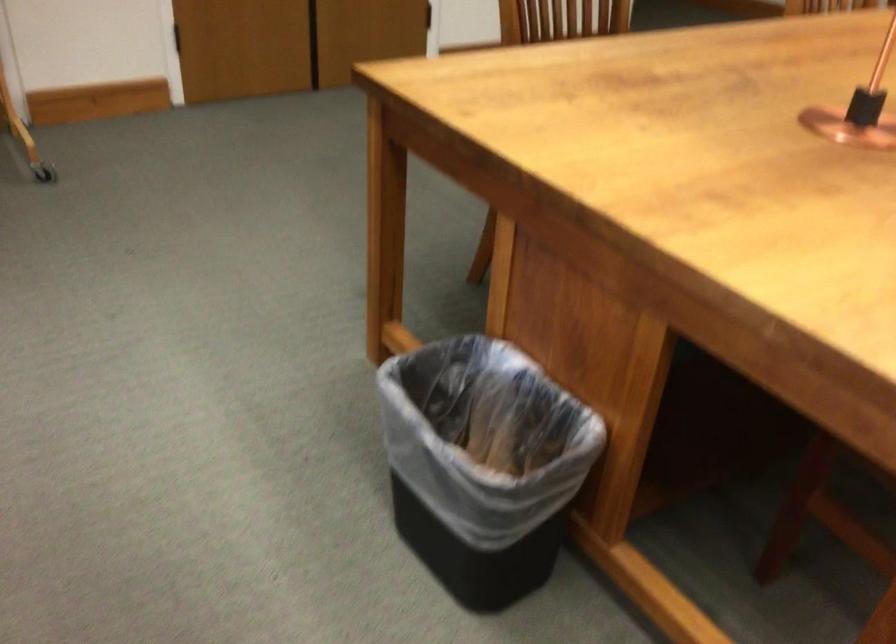
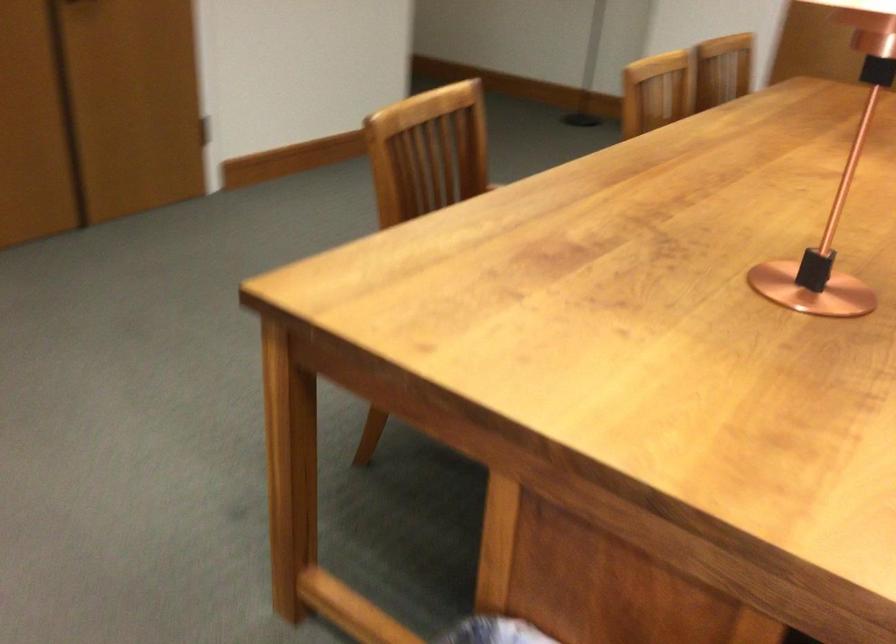
In a continuous first-person perspective shot, in which direction is the camera moving?

The cameraman moved toward left, forward.